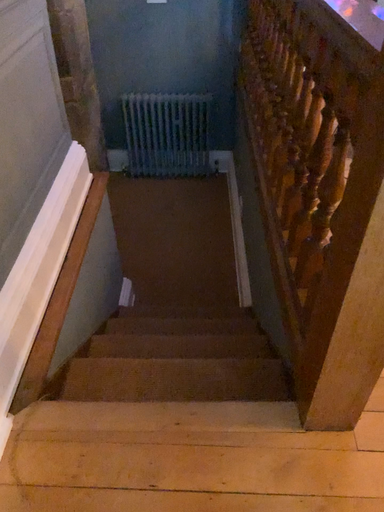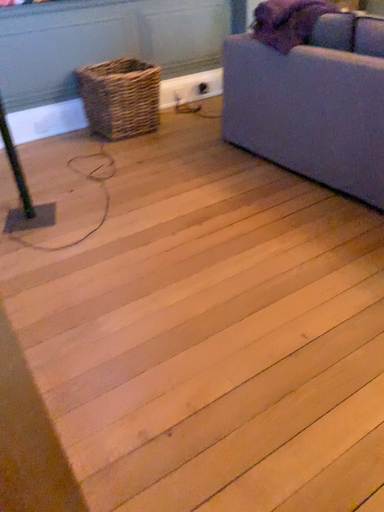
Question: How did the camera likely rotate when shooting the video?

Choices:
 (A) rotated right
 (B) rotated left

Answer: (A)